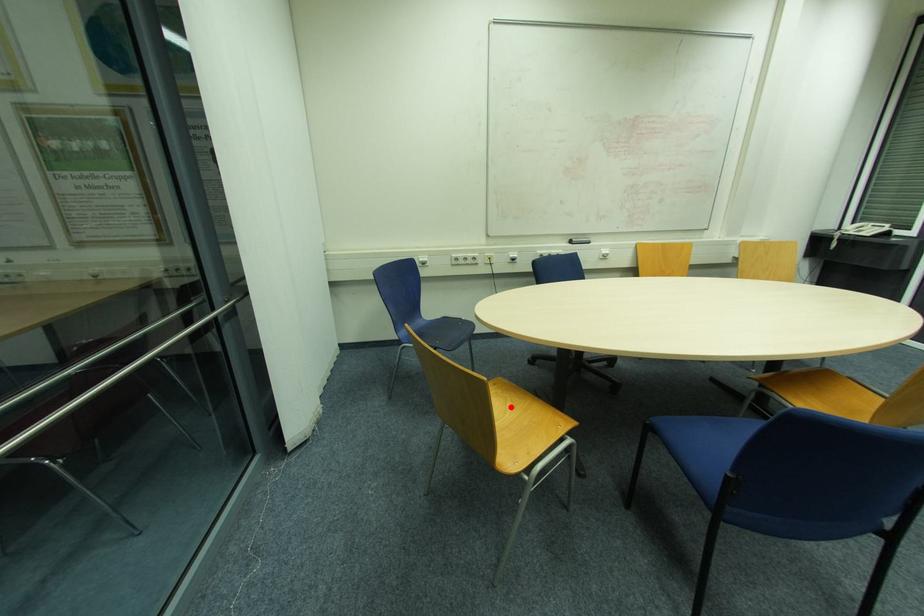
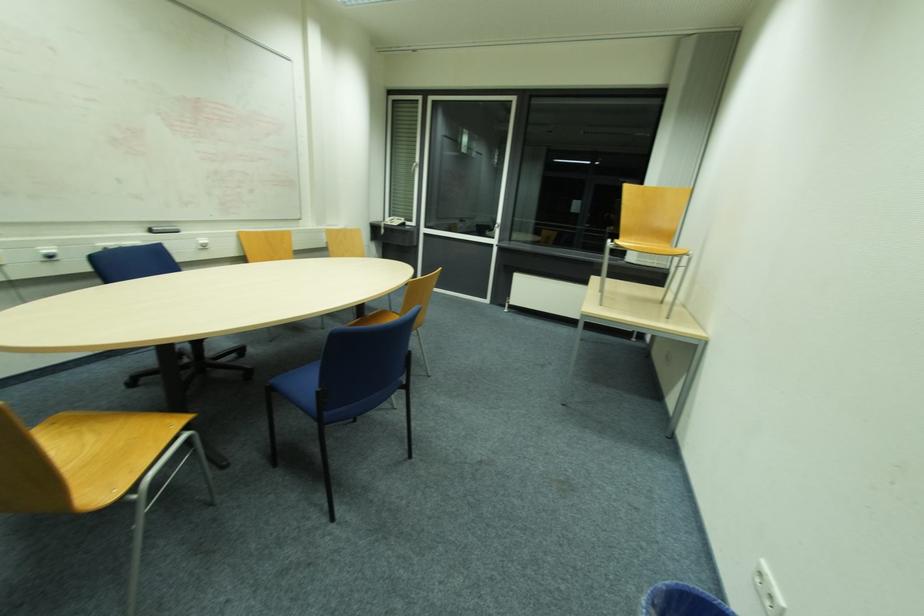
The point at the highlighted location is marked in the first image. Where is the corresponding point in the second image?

(91, 439)